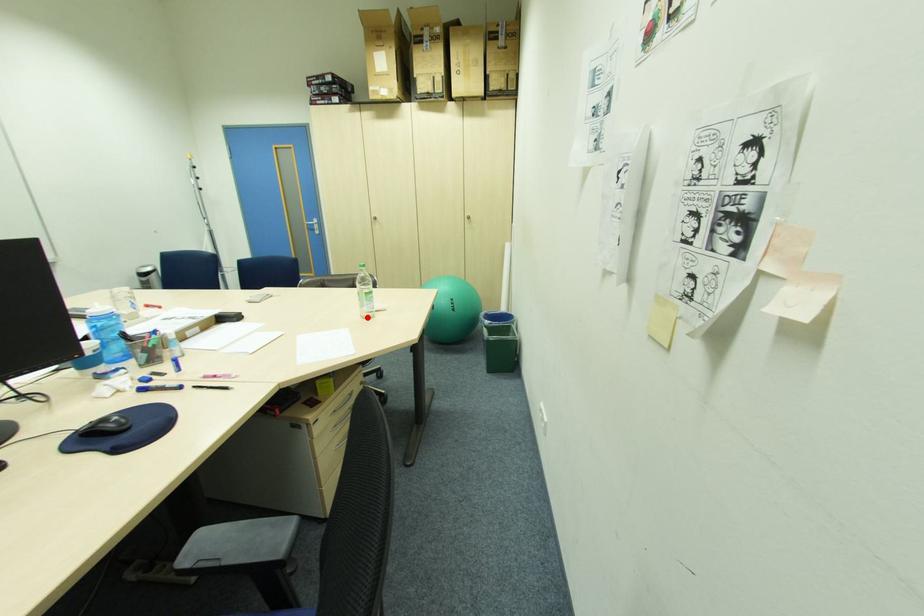
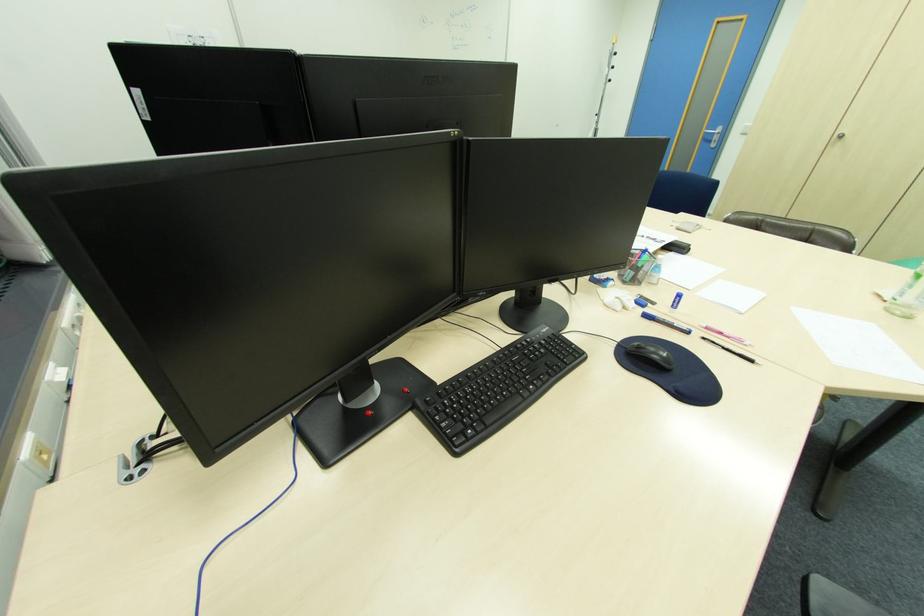
The point at the highlighted location is marked in the first image. Where is the corresponding point in the second image?

(894, 310)